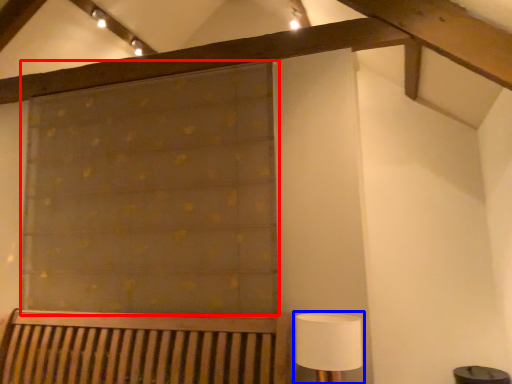
Question: Which object is further to the camera taking this photo, curtain (highlighted by a red box) or table lamp (highlighted by a blue box)?

Choices:
 (A) curtain
 (B) table lamp

Answer: (A)